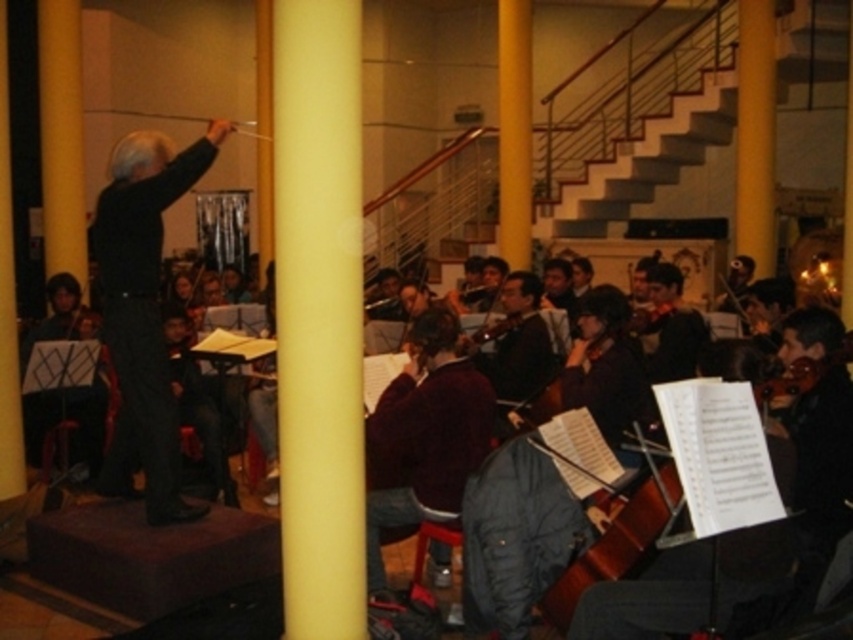
You are a photographer taking a picture of the black matte conductor at center and the maroon sweater at center. Which one should you focus on if you want to capture the taller object in the scene?

The black matte conductor at center should be focused on because it has a greater height compared to the maroon sweater at center.

You are standing at the point labeled point (653, 125) and want to move to the front of the stage. Which direction should you move relative to point (123, 461)?

To move to the front of the stage from point (653, 125), you should move in the same direction as point (123, 461) since it is already positioned in front of your current location.